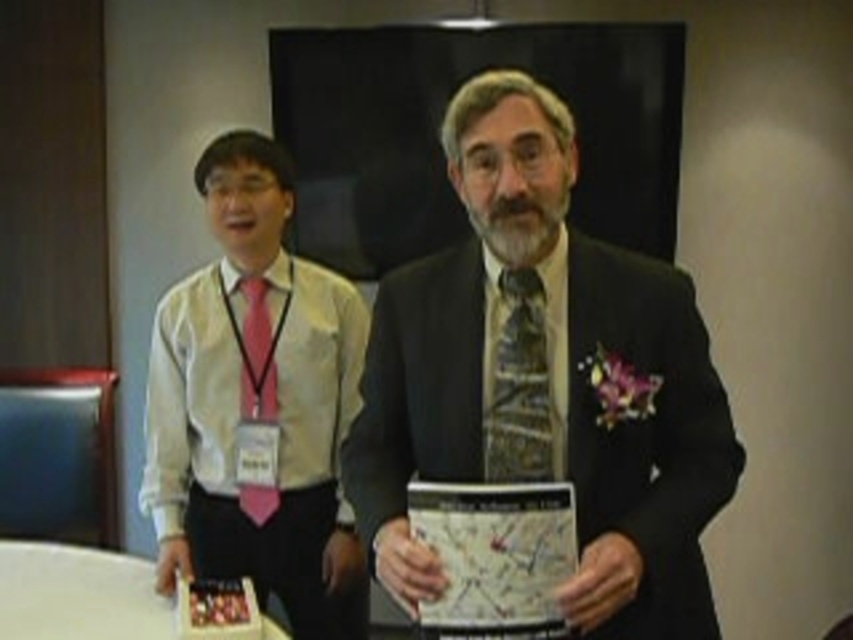
You are at a conference and need to hand a document to the person with the patterned silk tie at center. If you are standing 5 feet away from them, can you reach them without moving?

The distance between you and the patterned silk tie at center is 5.14 feet, so you cannot reach them without moving since you are 5 feet away.

You are organizing a charity event and need to decide which tie to wear. You have a patterned silk tie at center and a pink satin tie at left. If you want to wear the shorter one, which one should you choose?

The patterned silk tie at center has a lesser height compared to the pink satin tie at left, so you should choose the patterned silk tie at center if you want to wear the shorter one.

You are at a conference and need to place your conference materials on the nearest table. You are standing between the white glossy round table at lower left and the pink satin tie at left. Which object is closer to you?

The white glossy round table at lower left is closer to you because it is positioned to the left of the pink satin tie at left, meaning it is nearer in your current position between them.